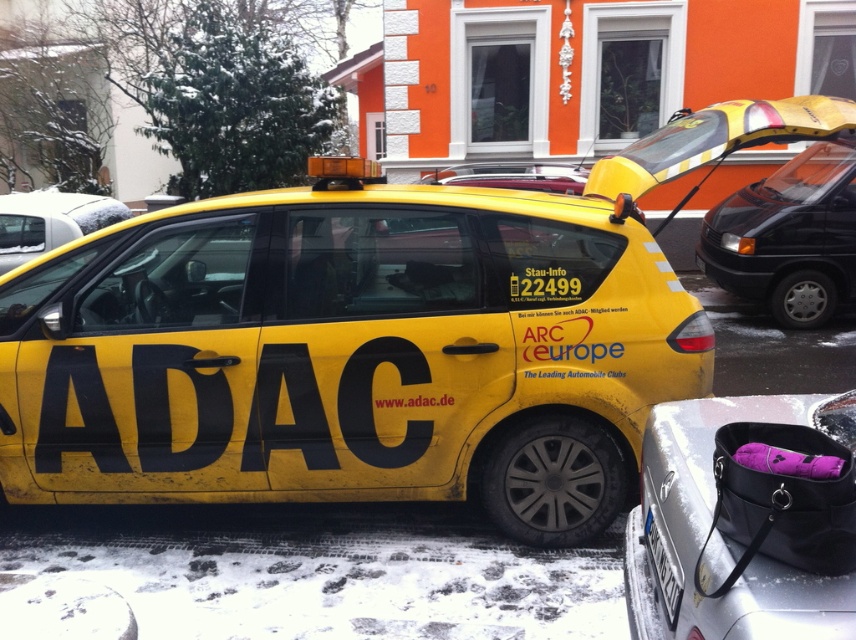
You are a pedestrian standing on the sidewalk and want to read the license plate of the yellow matte car at center. Is the white plastic license plate at lower center visible to you?

The white plastic license plate at lower center is behind the yellow matte car at center, so it is not visible to you from the sidewalk.

You are a pedestrian standing on the snowy street and see the yellow matte taxi at center and the black leather handbag at lower right. Which object is closer to your right side?

The black leather handbag at lower right is closer to your right side because it is positioned to the right of the yellow matte taxi at center.